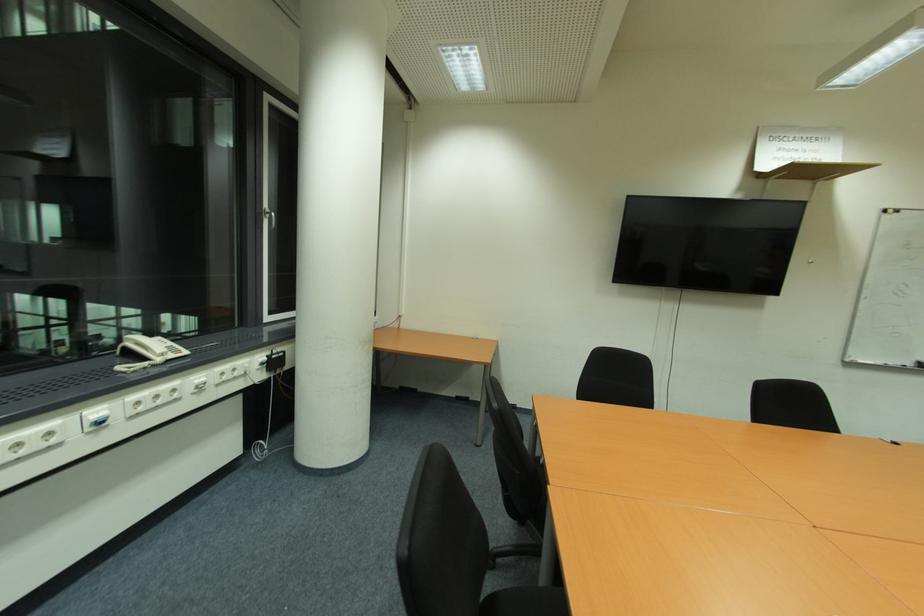
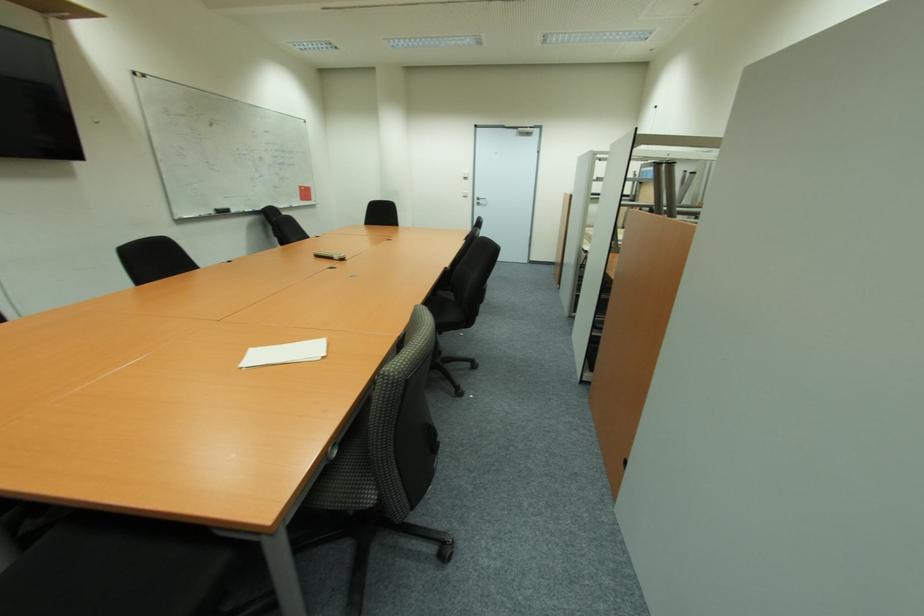
How did the camera likely rotate?

The camera rotated toward right-down.